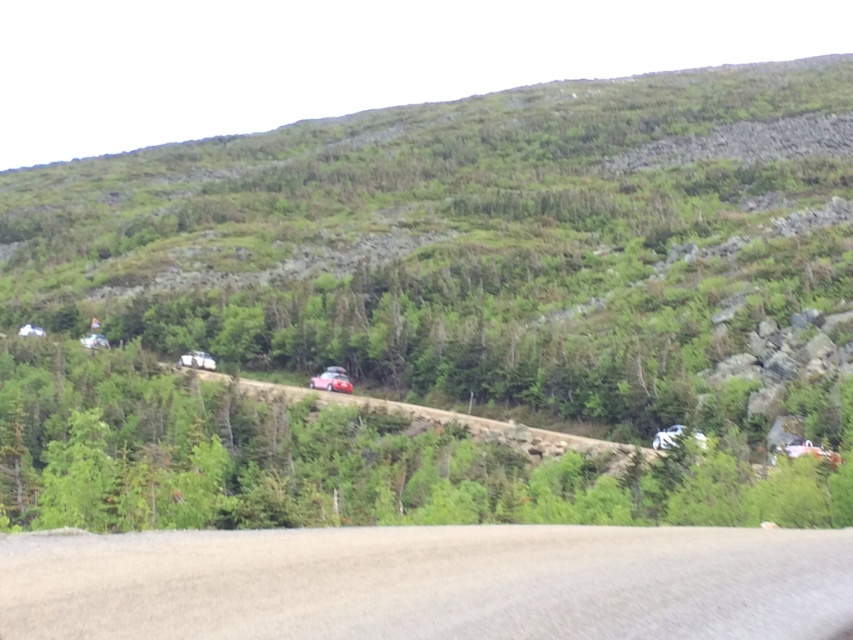
Question: Observing the image, what is the correct spatial positioning of brown gravel road at lower center in reference to glossy red car at center?

Choices:
 (A) above
 (B) below

Answer: (A)

Question: Is green matte tree at center thinner than metallic silver car at center?

Choices:
 (A) yes
 (B) no

Answer: (B)

Question: Which point is closer to the camera?

Choices:
 (A) green grassy hillside at upper center
 (B) green matte tree at center
 (C) glossy red car at center

Answer: (B)

Question: Which object is farther from the camera taking this photo?

Choices:
 (A) metallic silver car at center
 (B) brown gravel road at lower center

Answer: (A)

Question: Is green grassy hillside at upper center in front of brown gravel road at lower center?

Choices:
 (A) no
 (B) yes

Answer: (A)

Question: Which point is farther to the camera?

Choices:
 (A) metallic silver van at center
 (B) brown gravel road at lower center
 (C) metallic silver car at center

Answer: (A)